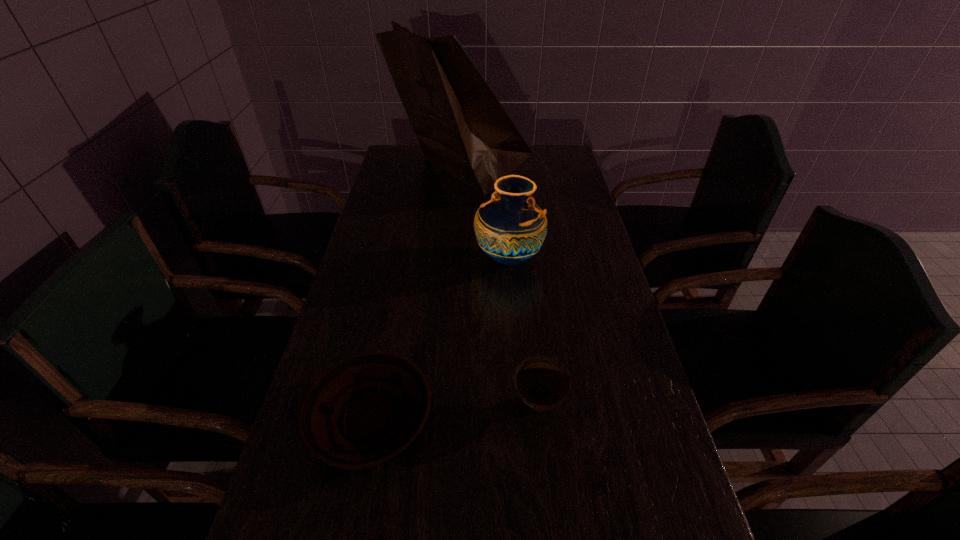
This screenshot has width=960, height=540. I want to click on free area in between the soup bowl and the third shortest object, so click(523, 332).

Where is `vacant point located between the grocery bag and the plate`? vacant point located between the grocery bag and the plate is located at coordinates (415, 296).

The width and height of the screenshot is (960, 540). I want to click on free space between the third tallest object and the third nearest object, so pos(523,332).

At what (x,y) coordinates should I click in order to perform the action: click on vacant area that lies between the third tallest object and the pottery. Please return your answer as a coordinate pair (x, y). The height and width of the screenshot is (540, 960). Looking at the image, I should click on (523, 332).

The height and width of the screenshot is (540, 960). Find the location of `object that is the second closest to the soup bowl`. object that is the second closest to the soup bowl is located at coordinates (510, 228).

Point out which object is positioned as the nearest to the plate. Please provide its 2D coordinates. Your answer should be formatted as a tuple, i.e. [(x, y)], where the tuple contains the x and y coordinates of a point satisfying the conditions above.

[(542, 382)]

The height and width of the screenshot is (540, 960). I want to click on vacant point that satisfies the following two spatial constraints: 1. on the front side of the second tallest object; 2. on the left side of the grocery bag, so click(x=453, y=258).

This screenshot has width=960, height=540. Find the location of `free region that satisfies the following two spatial constraints: 1. on the front side of the second tallest object; 2. on the right side of the third tallest object`. free region that satisfies the following two spatial constraints: 1. on the front side of the second tallest object; 2. on the right side of the third tallest object is located at coordinates (520, 405).

Where is `free space that satisfies the following two spatial constraints: 1. on the back side of the second tallest object; 2. on the right side of the shortest object`? Image resolution: width=960 pixels, height=540 pixels. free space that satisfies the following two spatial constraints: 1. on the back side of the second tallest object; 2. on the right side of the shortest object is located at coordinates (403, 258).